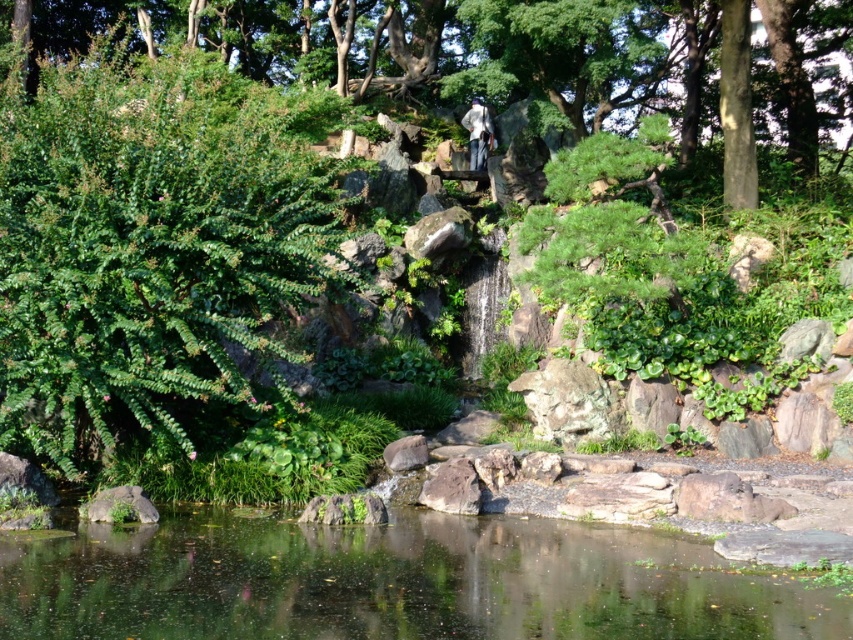
Between transparent water at center and white fabric at center, which one appears on the left side from the viewer's perspective?

Positioned to the left is transparent water at center.

Is point (412, 561) positioned in front of point (486, 112)?

Yes, it is in front of point (486, 112).

This screenshot has height=640, width=853. Identify the location of transparent water at center. (395, 580).

Image resolution: width=853 pixels, height=640 pixels. I want to click on green leafy tree at upper center, so click(x=515, y=58).

Can you confirm if green leafy tree at upper center is wider than white fabric at center?

Yes.

Does point (287, 20) lie in front of point (480, 120)?

No, (287, 20) is behind (480, 120).

Where is `green leafy tree at upper center`? green leafy tree at upper center is located at coordinates (515, 58).

In the scene shown: Is transparent water at center above green leafy tree at upper center?

No, transparent water at center is not above green leafy tree at upper center.

Is transparent water at center to the left of green leafy tree at upper center from the viewer's perspective?

Correct, you'll find transparent water at center to the left of green leafy tree at upper center.

Measure the distance between transparent water at center and camera.

9.34 meters

Locate an element on the screen. transparent water at center is located at coordinates (395, 580).